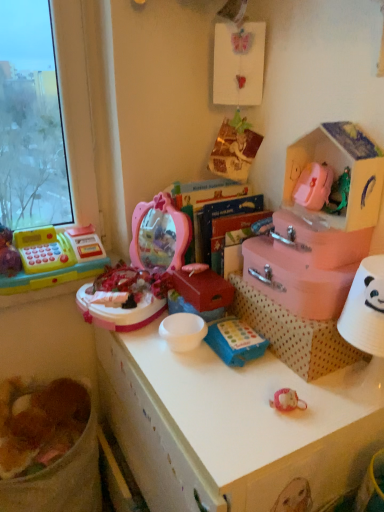
Where is `free area in between polka dot cardboard box at center and blue fabric toy at center, which ranks as the second toy in top-to-bottom order`? This screenshot has height=512, width=384. free area in between polka dot cardboard box at center and blue fabric toy at center, which ranks as the second toy in top-to-bottom order is located at coordinates (264, 376).